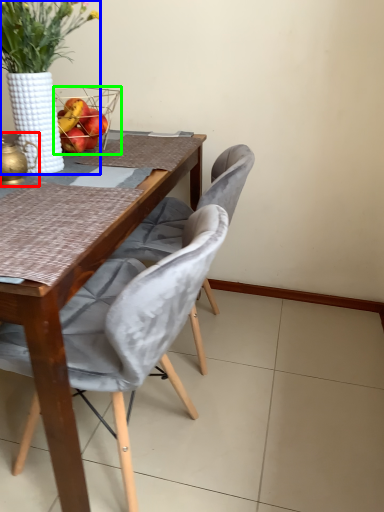
Question: Which object is the farthest from tea pot (highlighted by a red box)? Choose among these: houseplant (highlighted by a blue box) or picnic basket (highlighted by a green box).

Choices:
 (A) houseplant
 (B) picnic basket

Answer: (B)